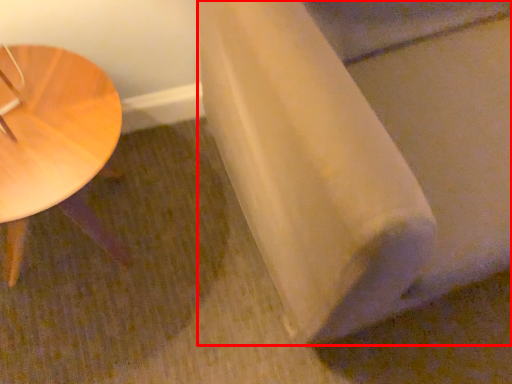
Question: From the image, what is the correct spatial relationship of linen (annotated by the red box) in relation to table?

Choices:
 (A) left
 (B) right

Answer: (B)